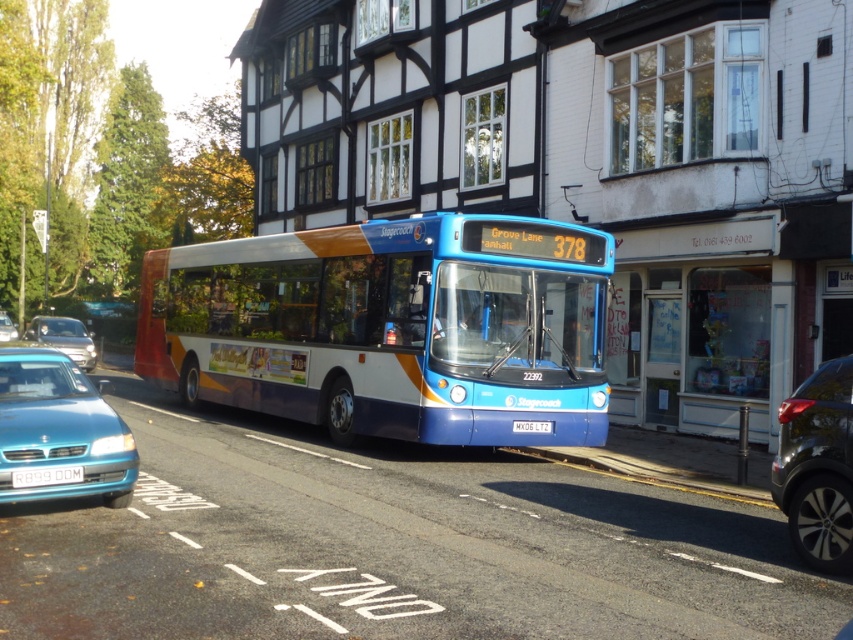
Is point (627, 392) more distant than point (526, 419)?

Yes, it is.

Between glass door at center and white plastic license plate at center, which one has more height?

glass door at center

Between point (675, 232) and point (519, 432), which one is positioned in front?

Point (519, 432) is more forward.

Where is `glass door at center`? glass door at center is located at coordinates (701, 326).

Image resolution: width=853 pixels, height=640 pixels. Identify the location of glass door at center. (701, 326).

Describe the element at coordinates (701, 326) in the screenshot. I see `glass door at center` at that location.

Where is `glass door at center`? The height and width of the screenshot is (640, 853). glass door at center is located at coordinates (701, 326).

Does teal glossy sedan at lower left have a lesser height compared to shiny black car at right?

Correct, teal glossy sedan at lower left is not as tall as shiny black car at right.

Does point (96, 444) come farther from viewer compared to point (830, 440)?

Yes, point (96, 444) is farther from viewer.

What do you see at coordinates (59, 433) in the screenshot? I see `teal glossy sedan at lower left` at bounding box center [59, 433].

Locate an element on the screen. teal glossy sedan at lower left is located at coordinates (59, 433).